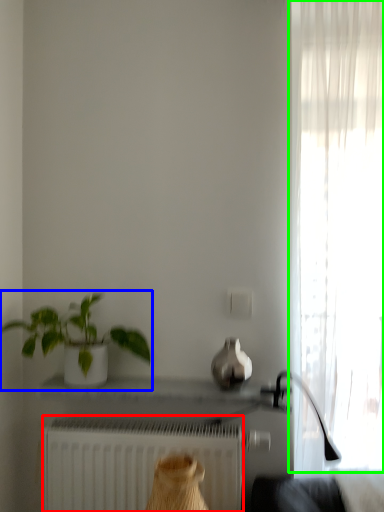
Question: Which object is the farthest from radiator (highlighted by a red box)? Choose among these: houseplant (highlighted by a blue box) or curtain (highlighted by a green box).

Choices:
 (A) houseplant
 (B) curtain

Answer: (B)